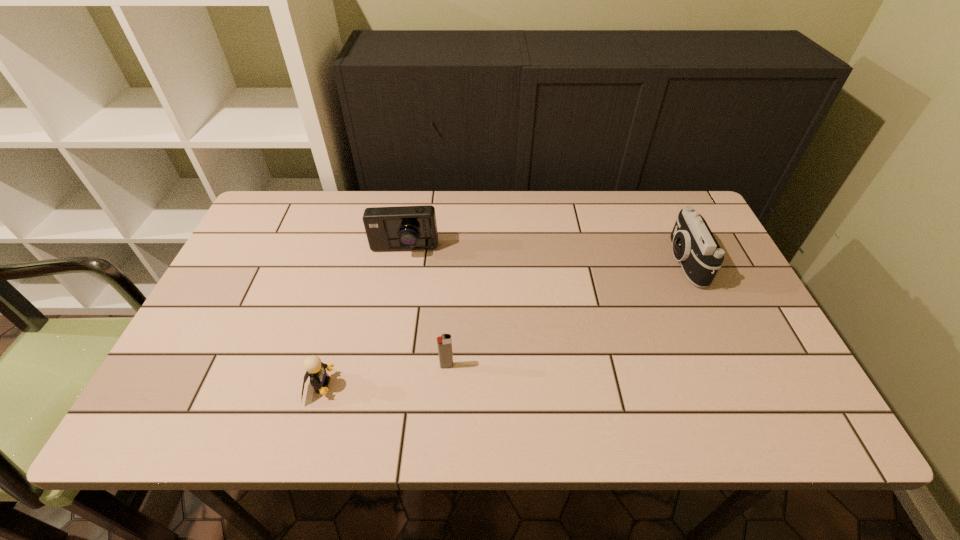
Where is `object situated at the near edge`? This screenshot has height=540, width=960. object situated at the near edge is located at coordinates (316, 370).

Identify the location of object situated at the right edge. The image size is (960, 540). (693, 243).

The width and height of the screenshot is (960, 540). I want to click on object present at the far right corner, so click(693, 243).

Image resolution: width=960 pixels, height=540 pixels. In order to click on blank space at the far edge in this screenshot , I will do `click(580, 210)`.

This screenshot has height=540, width=960. Find the location of `free location at the left edge`. free location at the left edge is located at coordinates (239, 354).

In the image, there is a desktop. Identify the location of vacant region at the right edge. This screenshot has width=960, height=540. (785, 379).

Where is `vacant space at the far left corner`? vacant space at the far left corner is located at coordinates (288, 227).

You are a GUI agent. You are given a task and a screenshot of the screen. Output one action in this format:
    pyautogui.click(x=<x>, y=<y>)
    Task: Click on the empty space between the rightmost object and the Lego
    This screenshot has height=540, width=960.
    Given the screenshot: What is the action you would take?
    pos(502,323)

The width and height of the screenshot is (960, 540). I want to click on free space between the third object from left to right and the second object from left to right, so click(x=425, y=308).

This screenshot has width=960, height=540. What are the coordinates of `empty space that is in between the right camera and the left camera` in the screenshot? It's located at (544, 255).